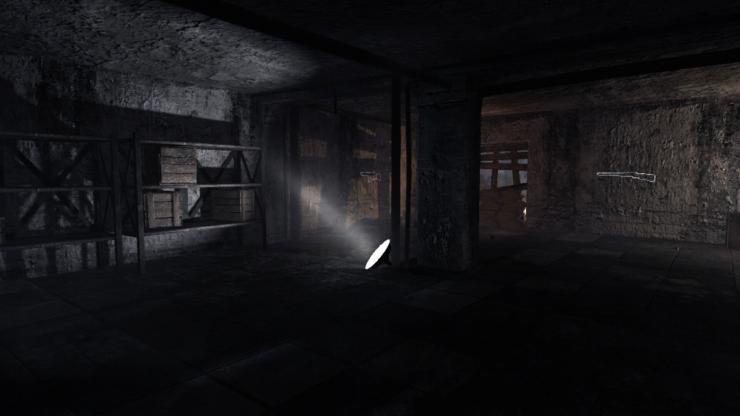
Find the location of a particular element. This screenshot has width=740, height=416. doorway is located at coordinates (511, 175).